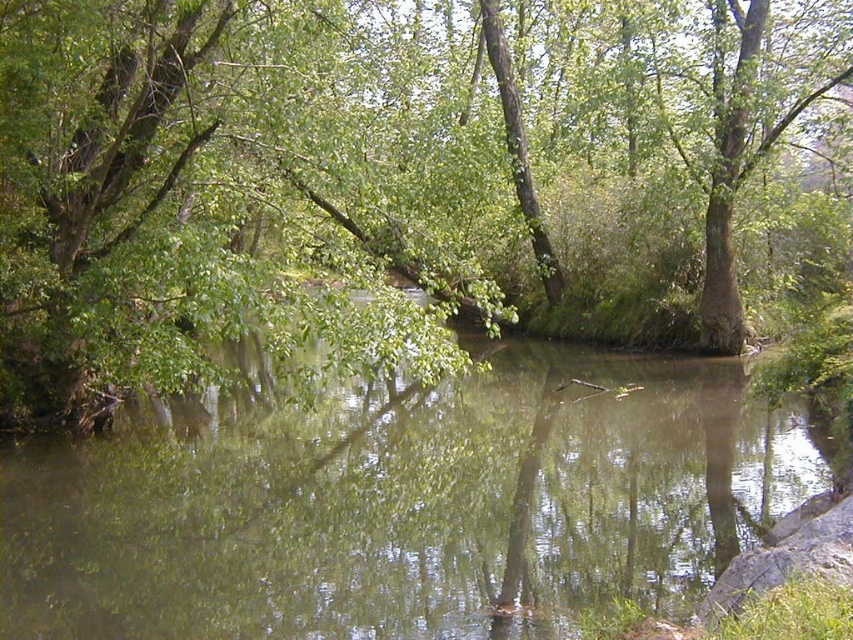
Question: Can you confirm if green leafy tree at center is smaller than green reflective water at center?

Choices:
 (A) yes
 (B) no

Answer: (B)

Question: Observing the image, what is the correct spatial positioning of green leafy tree at center in reference to green reflective water at center?

Choices:
 (A) right
 (B) left

Answer: (A)

Question: Which object is farther from the camera taking this photo?

Choices:
 (A) green leafy tree at center
 (B) green reflective water at center

Answer: (A)

Question: Which of the following is the closest to the observer?

Choices:
 (A) green reflective water at center
 (B) green leafy tree at center

Answer: (A)

Question: Can you confirm if green leafy tree at center is positioned to the left of green reflective water at center?

Choices:
 (A) no
 (B) yes

Answer: (A)